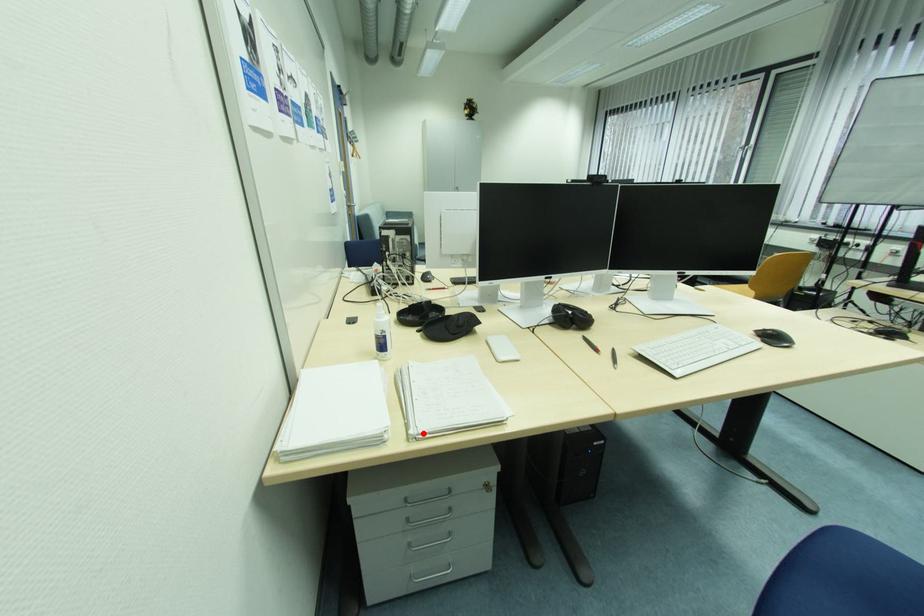
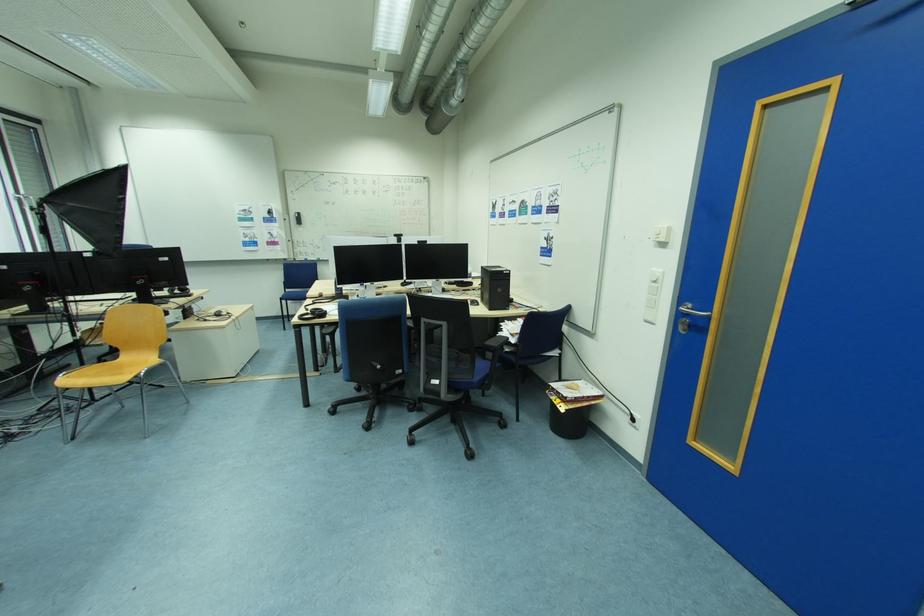
Question: I am providing you with two images of the same scene from different viewpoints. A red point is marked on the first image. Can you still see the location of the red point in image 2?

Choices:
 (A) Yes
 (B) No

Answer: (B)